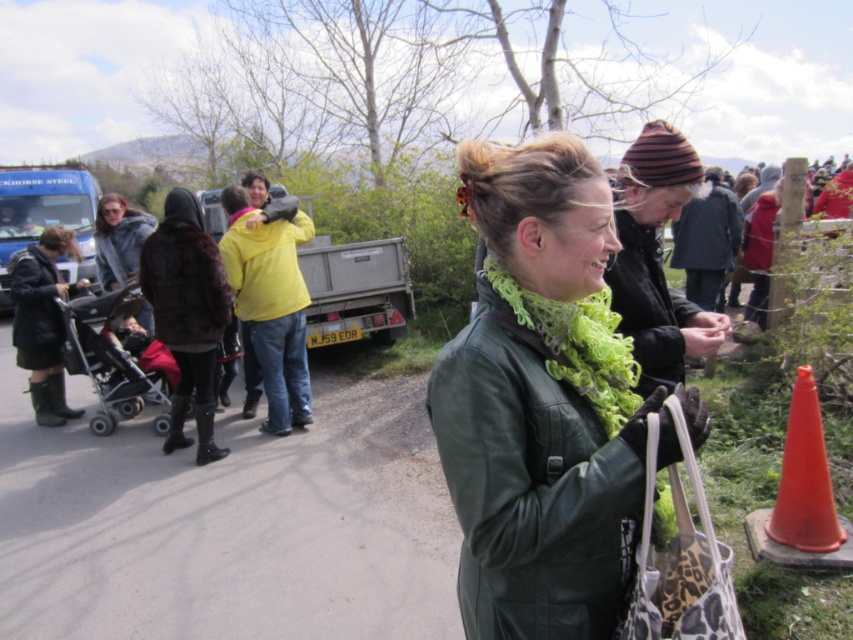
In the scene described, there is a woman wearing a dark green leather jacket and a bright lime green scarf. A point at coordinates (577, 344) is marked. Which object does this point correspond to?

The point at (577, 344) corresponds to the green fuzzy scarf at center.

You are a photographer trying to capture a photo of the woman and her belongings. You notice the green fuzzy scarf at center and the black plastic stroller at left. Which object should you focus on first if you want to ensure both are in the frame without moving the camera?

The green fuzzy scarf at center is above the black plastic stroller at left, so you should focus on the black plastic stroller at left first to ensure both are in the frame without moving the camera.

You are taking a photo of two points in the scene. The first point is at coordinates point [665,493] and the second point is at point [242,285]. Which point will appear larger in your photo?

Point [665,493] is closer to the camera than point [242,285], so it will appear larger in the photo.